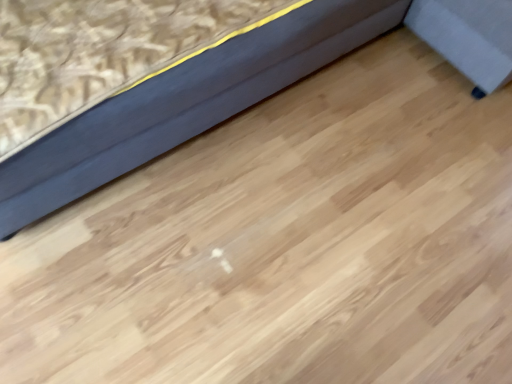
What do you see at coordinates (183, 104) in the screenshot? I see `matte gray sofa at upper left` at bounding box center [183, 104].

Identify the location of matte gray sofa at upper left. The width and height of the screenshot is (512, 384). (183, 104).

This screenshot has width=512, height=384. I want to click on matte gray sofa at upper left, so click(183, 104).